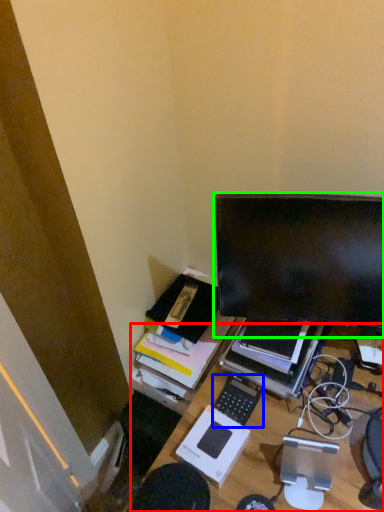
Question: Considering the real-world distances, which object is closest to desk (highlighted by a red box)? computer keyboard (highlighted by a blue box) or computer monitor (highlighted by a green box).

Choices:
 (A) computer keyboard
 (B) computer monitor

Answer: (A)